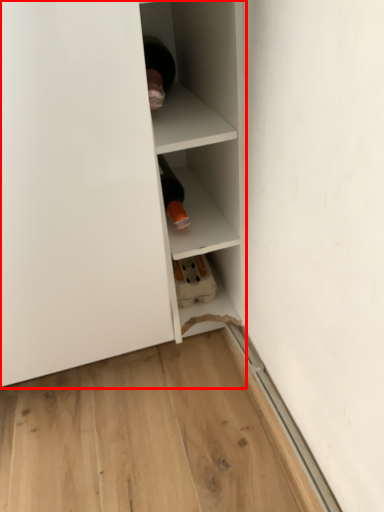
Question: From the image, what is the correct spatial relationship of shelf (annotated by the red box) in relation to shelf?

Choices:
 (A) right
 (B) left

Answer: (B)